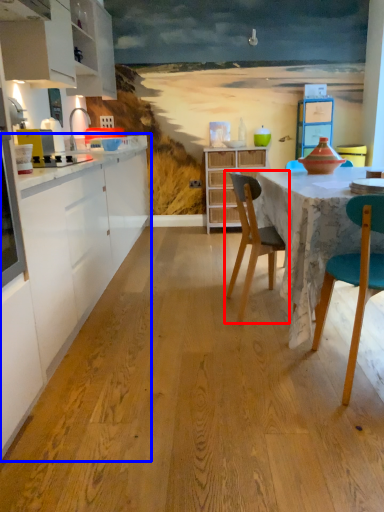
Question: Which point is further to the camera, chair (highlighted by a red box) or countertop (highlighted by a blue box)?

Choices:
 (A) chair
 (B) countertop

Answer: (A)